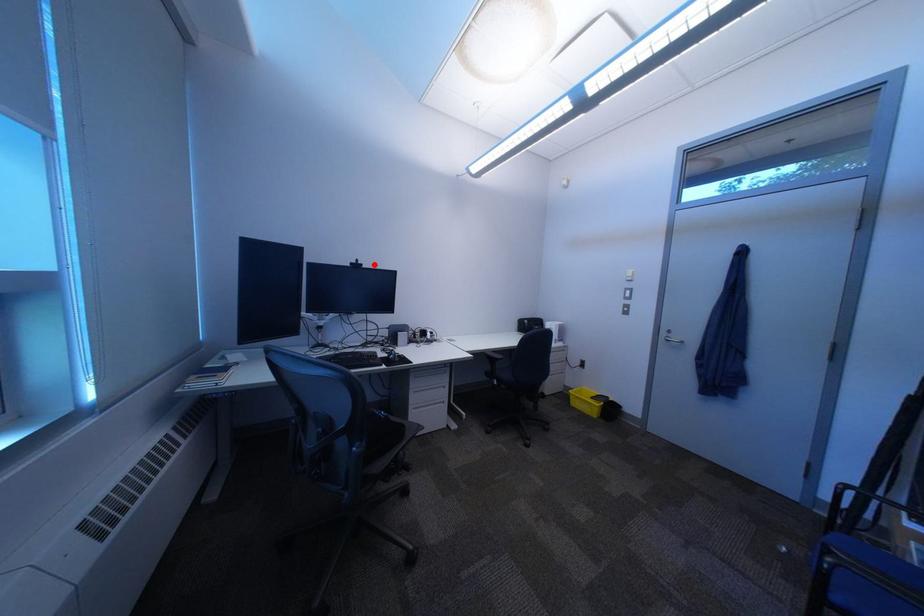
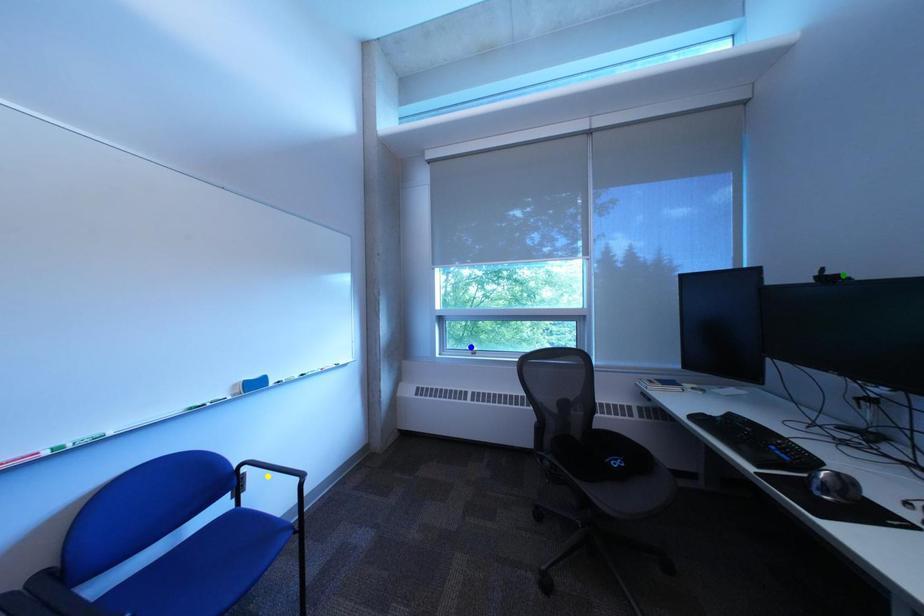
Question: I am providing you with two images of the same scene from different viewpoints. A red point is marked on the first image. You are given multiple points on the second image. Which point in image 2 represents the same 3d spot as the red point in image 1?

Choices:
 (A) green point
 (B) yellow point
 (C) blue point

Answer: (A)